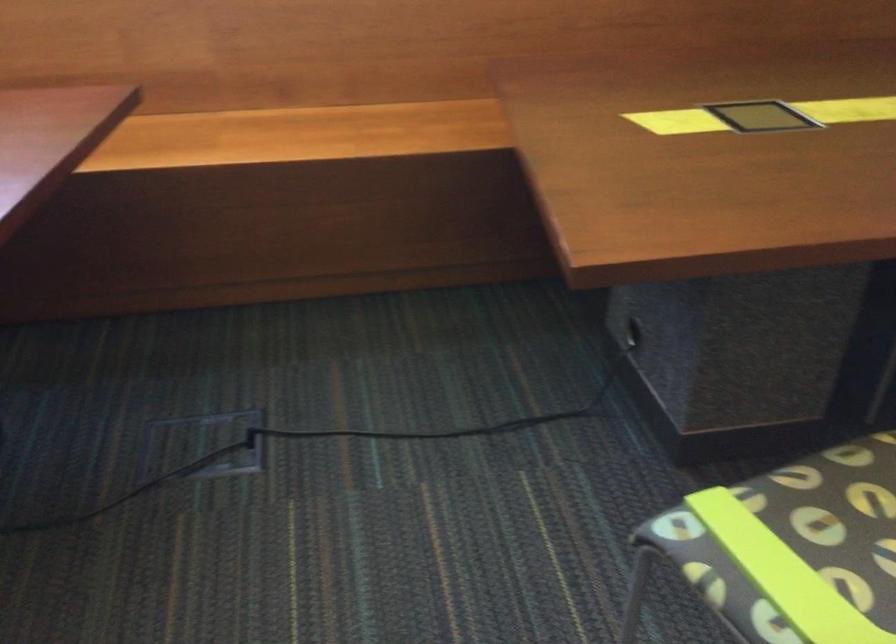
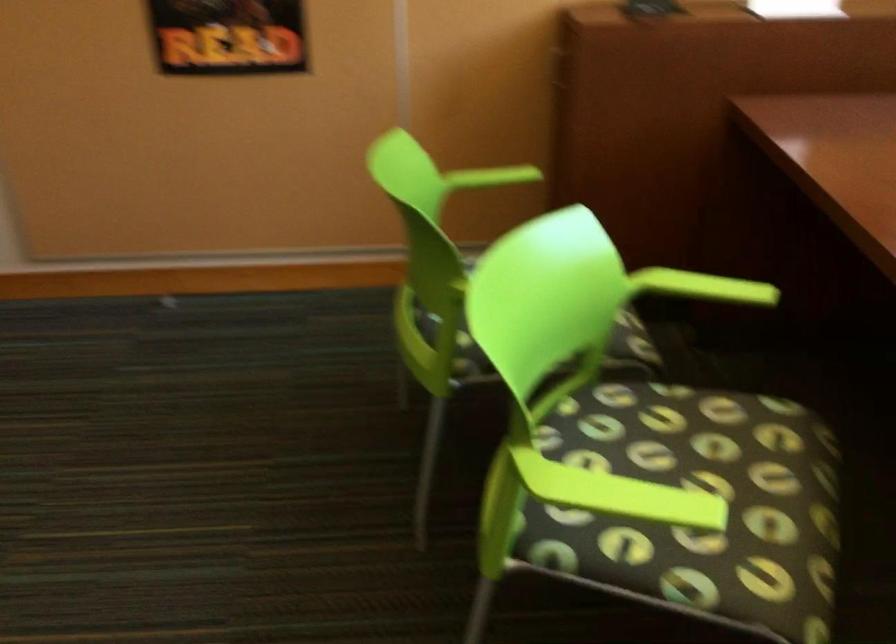
The first image is from the beginning of the video and the second image is from the end. How did the camera likely rotate when shooting the video?

The camera rotated toward left-down.